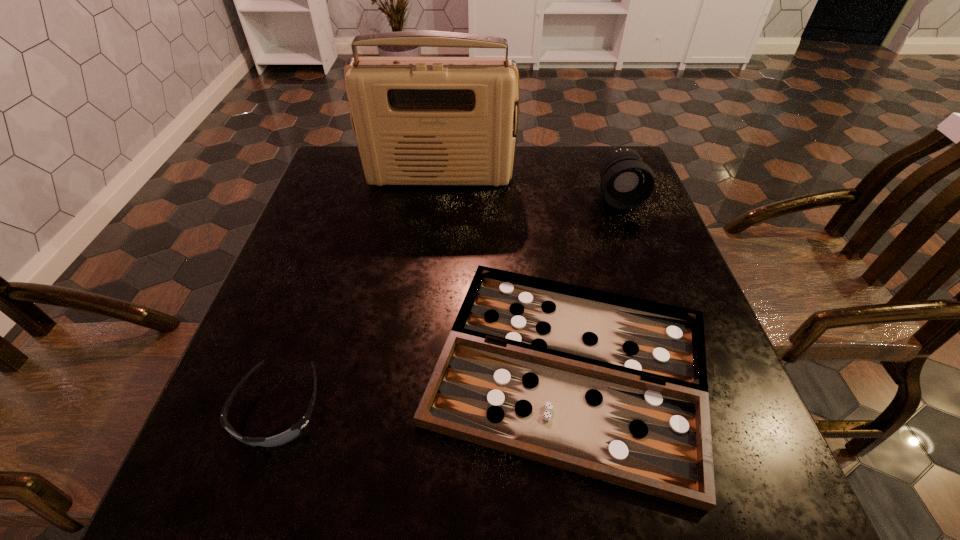
Identify the location of the tallest object. (417, 120).

Locate an element on the screen. This screenshot has width=960, height=540. telephoto lens is located at coordinates (626, 181).

You are a GUI agent. You are given a task and a screenshot of the screen. Output one action in this format:
    pyautogui.click(x=<x>, y=<y>)
    Task: Click on the third tallest object
    The image size is (960, 540).
    Given the screenshot: What is the action you would take?
    pyautogui.click(x=296, y=430)

Find the location of `the shortest object`. the shortest object is located at coordinates (613, 387).

Locate an element on the screen. The height and width of the screenshot is (540, 960). blank area located 0.310m on the front-facing side of the tallest object is located at coordinates (428, 275).

The height and width of the screenshot is (540, 960). What are the coordinates of `vacant space situated 0.330m at the front element of the third shortest object` in the screenshot? It's located at (661, 314).

Locate an element on the screen. Image resolution: width=960 pixels, height=540 pixels. free space located 0.050m on the lenses of the third tallest object is located at coordinates (252, 488).

This screenshot has height=540, width=960. Identify the location of vacant space situated on the left of the gameboard. (359, 369).

This screenshot has width=960, height=540. I want to click on radio receiver located in the far edge section of the desktop, so click(x=417, y=120).

Identify the location of telephoto lens present at the far edge. The image size is (960, 540). (626, 181).